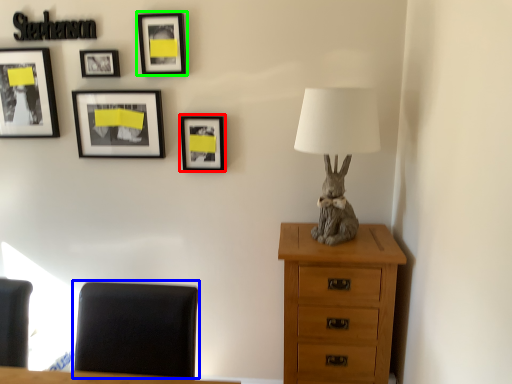
Question: Which object is the closest to the picture frame (highlighted by a red box)? Choose among these: furniture (highlighted by a blue box) or picture frame (highlighted by a green box).

Choices:
 (A) furniture
 (B) picture frame

Answer: (B)